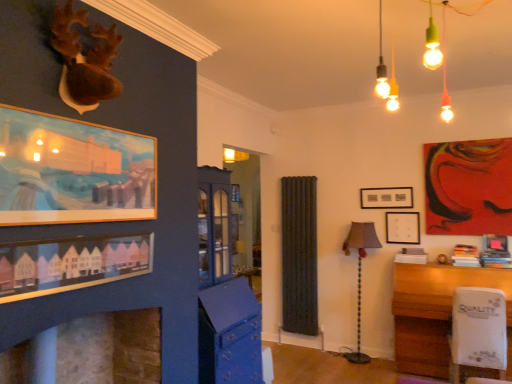
Where is `matte wooden picture frame at lower left, which is the fourth picture frame from right to left`? The image size is (512, 384). matte wooden picture frame at lower left, which is the fourth picture frame from right to left is located at coordinates (70, 264).

What do you see at coordinates (479, 330) in the screenshot? This screenshot has height=384, width=512. I see `white plastic swivel chair at lower right` at bounding box center [479, 330].

How much space does matte black picture frame at center, the first picture frame viewed from the back, occupy horizontally?

The width of matte black picture frame at center, the first picture frame viewed from the back, is 1.99 inches.

At what (x,y) coordinates should I click in order to perform the action: click on matte pink picture frame at upper right, placed as the fifth picture frame when sorted from left to right. Please return your answer as a coordinate pair (x, y). The width and height of the screenshot is (512, 384). Looking at the image, I should click on (495, 243).

Based on the photo, does matte pink picture frame at upper right, which is the 3th picture frame in front-to-back order, come in front of matte black picture frame at center, the 2th picture frame positioned from the back?

Yes, it is.

From their relative heights in the image, would you say matte pink picture frame at upper right, which is the third picture frame from back to front, is taller or shorter than matte black picture frame at center, the 2th picture frame positioned from the back?

Considering their sizes, matte pink picture frame at upper right, which is the third picture frame from back to front, has less height than matte black picture frame at center, the 2th picture frame positioned from the back.

Which is more to the right, matte black picture frame at center, acting as the fifth picture frame starting from the front, or matte black picture frame at center, acting as the second picture frame starting from the right?

Positioned to the right is matte black picture frame at center, acting as the second picture frame starting from the right.

From a real-world perspective, starting from the matte black picture frame at center, acting as the fifth picture frame starting from the front, which picture frame is the 2nd one below it? Please provide its 2D coordinates.

[(402, 227)]

How different are the orientations of matte black picture frame at center, which is the third picture frame from right to left, and matte black picture frame at center, acting as the second picture frame starting from the right, in degrees?

matte black picture frame at center, which is the third picture frame from right to left, and matte black picture frame at center, acting as the second picture frame starting from the right, are facing 0.66 degrees away from each other.

Could you tell me if matte black picture frame at center, the first picture frame viewed from the back, is turned towards matte black picture frame at center, the 4th picture frame in the left-to-right sequence?

No, matte black picture frame at center, the first picture frame viewed from the back, is not oriented towards matte black picture frame at center, the 4th picture frame in the left-to-right sequence.

Which of these two, wooden framed painting at upper left, acting as the first picture frame starting from the left, or matte gray lampshade at center-right, is thinner?

wooden framed painting at upper left, acting as the first picture frame starting from the left, is thinner.

Which is more to the left, wooden framed painting at upper left, the fourth picture frame when ordered from back to front, or matte gray lampshade at center-right?

wooden framed painting at upper left, the fourth picture frame when ordered from back to front.

Looking at the image, does wooden framed painting at upper left, the fourth picture frame when ordered from back to front, seem bigger or smaller compared to matte gray lampshade at center-right?

Clearly, wooden framed painting at upper left, the fourth picture frame when ordered from back to front, is smaller in size than matte gray lampshade at center-right.

Considering the points (74, 134) and (346, 241), which point is in front, point (74, 134) or point (346, 241)?

The point (74, 134) is closer to the camera.

Is point (486, 373) closer or farther from the camera than point (362, 253)?

Point (486, 373).

Could you tell me if white glossy table at lower right is facing matte gray lampshade at center-right?

No, white glossy table at lower right is not oriented towards matte gray lampshade at center-right.

Is white glossy table at lower right inside the boundaries of matte gray lampshade at center-right, or outside?

white glossy table at lower right exists outside the volume of matte gray lampshade at center-right.

Which object is thinner, white glossy table at lower right or matte gray lampshade at center-right?

matte gray lampshade at center-right is thinner.

Does matte gray lampshade at center-right have a greater height compared to white plastic swivel chair at lower right?

Indeed, matte gray lampshade at center-right has a greater height compared to white plastic swivel chair at lower right.

Is matte gray lampshade at center-right behind white plastic swivel chair at lower right?

Yes.

From a real-world perspective, who is located higher, matte gray lampshade at center-right or white plastic swivel chair at lower right?

In real-world perspective, matte gray lampshade at center-right is above.

Is matte gray lampshade at center-right not close to white plastic swivel chair at lower right?

matte gray lampshade at center-right is positioned a significant distance from white plastic swivel chair at lower right.

How distant is matte gray lampshade at center-right from matte black picture frame at center, the 3th picture frame when ordered from left to right?

matte gray lampshade at center-right and matte black picture frame at center, the 3th picture frame when ordered from left to right, are 53.03 centimeters apart from each other.

Locate an element on the screen. The image size is (512, 384). table lamp in front of the matte black picture frame at center, the first picture frame viewed from the back is located at coordinates (360, 273).

From a real-world perspective, which object stands above the other?

matte black picture frame at center, the first picture frame viewed from the back, from a real-world perspective.

Would you say matte gray lampshade at center-right is a long distance from matte black picture frame at center, which is the third picture frame from right to left?

No, matte gray lampshade at center-right is in close proximity to matte black picture frame at center, which is the third picture frame from right to left.

Image resolution: width=512 pixels, height=384 pixels. What are the coordinates of `the 2nd picture frame below the wooden framed painting at upper left, the fourth picture frame when ordered from back to front (from the image's perspective)` in the screenshot? It's located at (70, 264).

Is wooden framed painting at upper left, acting as the first picture frame starting from the left, positioned far away from matte wooden picture frame at lower left, acting as the 2th picture frame starting from the left?

That's not correct — wooden framed painting at upper left, acting as the first picture frame starting from the left, is a little close to matte wooden picture frame at lower left, acting as the 2th picture frame starting from the left.

Is wooden framed painting at upper left, marked as the second picture frame in a front-to-back arrangement, thinner than matte wooden picture frame at lower left, the fifth picture frame from the back?

No, wooden framed painting at upper left, marked as the second picture frame in a front-to-back arrangement, is not thinner than matte wooden picture frame at lower left, the fifth picture frame from the back.

Between point (99, 166) and point (16, 254), which one is positioned in front?

Point (16, 254)

Which picture frame is the 1st one when counting from the back of the matte pink picture frame at upper right, which is the 3th picture frame in front-to-back order? Please provide its 2D coordinates.

[(402, 227)]

From a real-world perspective, count 2nd picture frames downward from the matte black picture frame at center, which is the third picture frame from right to left, and point to it. Please provide its 2D coordinates.

[(402, 227)]

Considering their positions, is matte pink picture frame at upper right, placed as the fifth picture frame when sorted from left to right, positioned closer to white glossy table at lower right than matte gray lampshade at center-right?

matte gray lampshade at center-right is closer to white glossy table at lower right.

Looking at the image, which one is located closer to matte black picture frame at center, the 2th picture frame positioned from the back, matte gray lampshade at center-right or wooden framed painting at upper left, marked as the second picture frame in a front-to-back arrangement?

Based on the image, matte gray lampshade at center-right appears to be nearer to matte black picture frame at center, the 2th picture frame positioned from the back.

Considering their positions, is matte black picture frame at center, the 4th picture frame in the left-to-right sequence, positioned further to matte gray lampshade at center-right than matte black picture frame at center, which is the third picture frame from right to left?

matte black picture frame at center, which is the third picture frame from right to left, is positioned further to the anchor matte gray lampshade at center-right.

Based on their spatial positions, is white plastic swivel chair at lower right or matte black picture frame at center, the 4th picture frame in the left-to-right sequence, further from stone fireplace at lower left?

Based on the image, matte black picture frame at center, the 4th picture frame in the left-to-right sequence, appears to be further to stone fireplace at lower left.

When comparing their distances from matte wooden picture frame at lower left, which is the first picture frame from front to back, does matte gray lampshade at center-right or matte black picture frame at center, acting as the fifth picture frame starting from the front, seem further?

Among the two, matte black picture frame at center, acting as the fifth picture frame starting from the front, is located further to matte wooden picture frame at lower left, which is the first picture frame from front to back.

From the picture: Considering their positions, is matte black picture frame at center, acting as the fifth picture frame starting from the front, positioned closer to white glossy table at lower right than matte wooden picture frame at lower left, which is the first picture frame from front to back?

matte black picture frame at center, acting as the fifth picture frame starting from the front, is positioned closer to the anchor white glossy table at lower right.

From the image, which object appears to be farther from matte black picture frame at center, acting as the second picture frame starting from the right, stone fireplace at lower left or white plastic swivel chair at lower right?

stone fireplace at lower left is positioned further to the anchor matte black picture frame at center, acting as the second picture frame starting from the right.

Which object lies nearer to the anchor point stone fireplace at lower left, matte black picture frame at center, acting as the second picture frame starting from the right, or matte gray lampshade at center-right?

matte gray lampshade at center-right is closer to stone fireplace at lower left.

Find the location of a particular element. The width and height of the screenshot is (512, 384). table between wooden framed painting at upper left, the fourth picture frame when ordered from back to front, and white plastic swivel chair at lower right is located at coordinates (436, 313).

The image size is (512, 384). What are the coordinates of `fireplace between wooden framed painting at upper left, the fourth picture frame when ordered from back to front, and matte black picture frame at center, the 4th picture frame in the left-to-right sequence, from front to back` in the screenshot? It's located at (110, 349).

Image resolution: width=512 pixels, height=384 pixels. What are the coordinates of `table lamp located between white plastic swivel chair at lower right and matte black picture frame at center, acting as the fifth picture frame starting from the front, in the depth direction` in the screenshot? It's located at (360, 273).

The image size is (512, 384). I want to click on fireplace located between matte wooden picture frame at lower left, which is the fourth picture frame from right to left, and matte black picture frame at center, the first picture frame viewed from the back, in the depth direction, so click(110, 349).